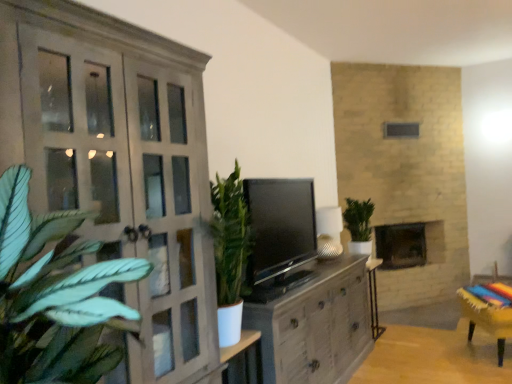
Where is `matte gray cupboard at left`? The width and height of the screenshot is (512, 384). matte gray cupboard at left is located at coordinates (119, 166).

Describe the element at coordinates (489, 311) in the screenshot. I see `wooden stool at lower right` at that location.

Describe the element at coordinates (374, 297) in the screenshot. I see `metallic silver table at lower right, placed as the first table when sorted from top to bottom` at that location.

Identify the location of matte gray cabinet at center. This screenshot has height=384, width=512. (316, 326).

Is point (274, 211) behind point (462, 343)?

No, (274, 211) is in front of (462, 343).

Does black glossy tv at center turn towards wooden table at lower right, placed as the 1th table when sorted from front to back?

No, black glossy tv at center is not facing towards wooden table at lower right, placed as the 1th table when sorted from front to back.

Image resolution: width=512 pixels, height=384 pixels. What are the coordinates of `level that is on the left side of wooden table at lower right, the 1th table in the right-to-left sequence` in the screenshot? It's located at (280, 235).

Can you confirm if black glossy tv at center is wider than wooden table at lower right, the 1th table in the right-to-left sequence?

No.

The width and height of the screenshot is (512, 384). In order to click on table in front of the wooden stool at lower right in this screenshot , I will do `click(434, 357)`.

Who is bigger, wooden table at lower right, the 1th table in the right-to-left sequence, or wooden stool at lower right?

wooden stool at lower right.

How many degrees apart are the facing directions of wooden table at lower right, the first table positioned from the bottom, and wooden stool at lower right?

The facing directions of wooden table at lower right, the first table positioned from the bottom, and wooden stool at lower right are 152 degrees apart.

Is wooden table at lower right, placed as the 1th table when sorted from front to back, in front of wooden stool at lower right?

Yes, the depth of wooden table at lower right, placed as the 1th table when sorted from front to back, is less than that of wooden stool at lower right.

Is matte gray cabinet at center not close to green leafy plant at center?

No.

From the image's perspective, is matte gray cabinet at center under green leafy plant at center?

Yes, from the image's perspective, matte gray cabinet at center is beneath green leafy plant at center.

Where is `cabinetry that appears below the green leafy plant at center (from the image's perspective)`? This screenshot has width=512, height=384. cabinetry that appears below the green leafy plant at center (from the image's perspective) is located at coordinates (316, 326).

Is matte gray cabinet at center oriented away from green leafy plant at center?

No, green leafy plant at center is not at the back of matte gray cabinet at center.

Which object is thinner, dark gray stone fireplace at center or black glossy tv at center?

black glossy tv at center.

From the image's perspective, relative to black glossy tv at center, is dark gray stone fireplace at center above or below?

Clearly, from the image's perspective, dark gray stone fireplace at center is below black glossy tv at center.

Between point (383, 226) and point (265, 216), which one is positioned behind?

The point (383, 226) is farther from the camera.

Considering their positions, is dark gray stone fireplace at center located in front of or behind black glossy tv at center?

dark gray stone fireplace at center is positioned farther from the viewer than black glossy tv at center.

Could dark gray stone fireplace at center be considered to be inside matte gray cupboard at left?

Actually, dark gray stone fireplace at center is outside matte gray cupboard at left.

Can you confirm if matte gray cupboard at left is thinner than dark gray stone fireplace at center?

In fact, matte gray cupboard at left might be wider than dark gray stone fireplace at center.

Image resolution: width=512 pixels, height=384 pixels. Identify the location of cupboard that is on the left side of dark gray stone fireplace at center. (119, 166).

In the scene shown: Considering the sizes of objects black glossy tv at center and matte gray cabinet at center in the image provided, who is bigger, black glossy tv at center or matte gray cabinet at center?

matte gray cabinet at center.

Looking at this image, is black glossy tv at center wider or thinner than matte gray cabinet at center?

Clearly, black glossy tv at center has less width compared to matte gray cabinet at center.

Can you tell me how much black glossy tv at center and matte gray cabinet at center differ in facing direction?

The angle between the facing direction of black glossy tv at center and the facing direction of matte gray cabinet at center is 0.351 degrees.

Looking at this image, from the image's perspective, which one is positioned higher, metallic silver table at lower right, which is the first table from left to right, or matte gray cabinet at center?

matte gray cabinet at center.

Does metallic silver table at lower right, which is the first table from left to right, turn towards matte gray cabinet at center?

No, metallic silver table at lower right, which is the first table from left to right, is not aimed at matte gray cabinet at center.

Based on the photo, is metallic silver table at lower right, which appears as the 2th table when viewed from the front, shorter than matte gray cabinet at center?

Yes.

Is metallic silver table at lower right, which appears as the 2th table when viewed from the front, to the right of matte gray cabinet at center from the viewer's perspective?

Correct, you'll find metallic silver table at lower right, which appears as the 2th table when viewed from the front, to the right of matte gray cabinet at center.

At what (x,y) coordinates should I click in order to perform the action: click on the 2nd table positioned below the black glossy tv at center (from the image's perspective). Please return your answer as a coordinate pair (x, y). This screenshot has width=512, height=384. Looking at the image, I should click on (434, 357).

The width and height of the screenshot is (512, 384). Find the location of `furniture that appears above the wooden table at lower right, which is the second table in left-to-right order (from the image's perspective)`. furniture that appears above the wooden table at lower right, which is the second table in left-to-right order (from the image's perspective) is located at coordinates tap(489, 311).

Considering their positions, is dark gray stone fireplace at center positioned closer to green leafy plant at center than matte gray cupboard at left?

The object closer to green leafy plant at center is dark gray stone fireplace at center.

Considering their positions, is wooden table at lower right, the first table positioned from the bottom, positioned further to matte gray cupboard at left than metallic silver table at lower right, which appears as the 2th table when viewed from the front?

metallic silver table at lower right, which appears as the 2th table when viewed from the front, is positioned further to the anchor matte gray cupboard at left.

From the image, which object appears to be farther from matte gray cupboard at left, dark gray stone fireplace at center or wooden table at lower right, the 1th table in the right-to-left sequence?

The object further to matte gray cupboard at left is dark gray stone fireplace at center.

Based on their spatial positions, is black glossy tv at center or wooden stool at lower right closer to dark gray stone fireplace at center?

wooden stool at lower right is closer to dark gray stone fireplace at center.

Which object lies further to the anchor point wooden table at lower right, acting as the 2th table starting from the top, dark gray stone fireplace at center or metallic silver table at lower right, acting as the second table starting from the bottom?

dark gray stone fireplace at center lies further to wooden table at lower right, acting as the 2th table starting from the top, than the other object.

When comparing their distances from green leafy plant at center, does wooden table at lower right, the first table positioned from the bottom, or dark gray stone fireplace at center seem further?

Based on the image, wooden table at lower right, the first table positioned from the bottom, appears to be further to green leafy plant at center.

Based on their spatial positions, is green leafy plant at center or matte gray cabinet at center closer to wooden table at lower right, acting as the 2th table starting from the top?

matte gray cabinet at center is closer to wooden table at lower right, acting as the 2th table starting from the top.

Considering their positions, is matte gray cabinet at center positioned further to metallic silver table at lower right, acting as the second table starting from the bottom, than green leafy plant at center?

matte gray cabinet at center is further to metallic silver table at lower right, acting as the second table starting from the bottom.

The height and width of the screenshot is (384, 512). Identify the location of table between wooden table at lower right, the first table positioned from the bottom, and dark gray stone fireplace at center, along the z-axis. (374, 297).

Locate an element on the screen. The width and height of the screenshot is (512, 384). level positioned between matte gray cabinet at center and dark gray stone fireplace at center from near to far is located at coordinates (280, 235).

Where is `level positioned between matte gray cupboard at left and metallic silver table at lower right, acting as the second table starting from the bottom, from near to far`? The height and width of the screenshot is (384, 512). level positioned between matte gray cupboard at left and metallic silver table at lower right, acting as the second table starting from the bottom, from near to far is located at coordinates (280, 235).

Image resolution: width=512 pixels, height=384 pixels. I want to click on houseplant located between matte gray cabinet at center and wooden stool at lower right in the left-right direction, so click(x=359, y=225).